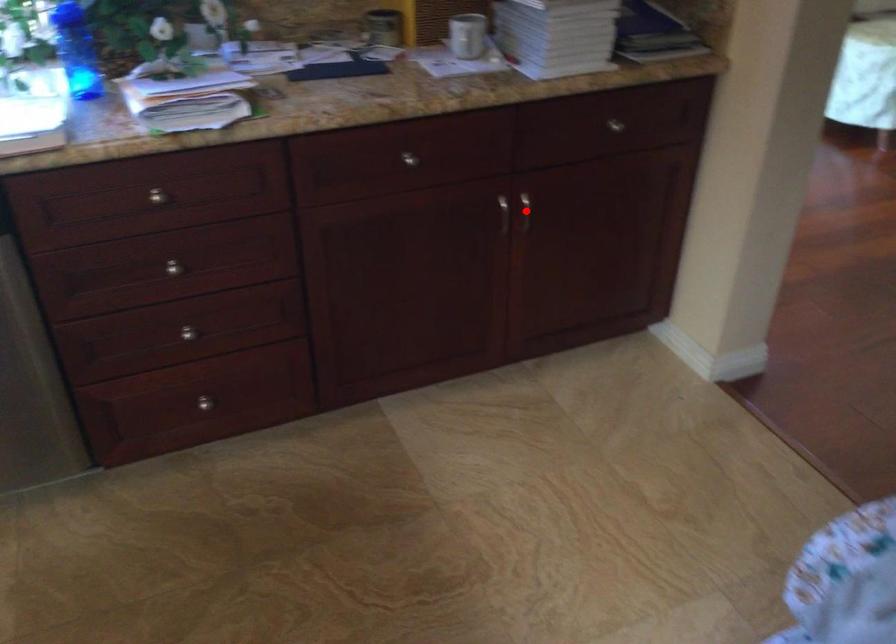
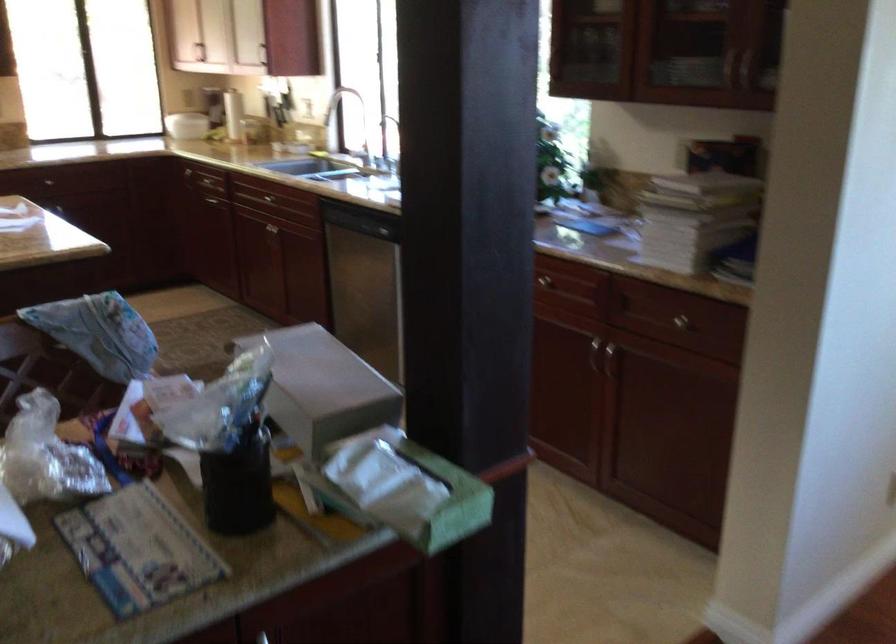
Question: I am providing you with two images of the same scene from different viewpoints. A red point is marked on the first image. Is the red point's position out of view in image 2?

Choices:
 (A) Yes
 (B) No

Answer: (B)